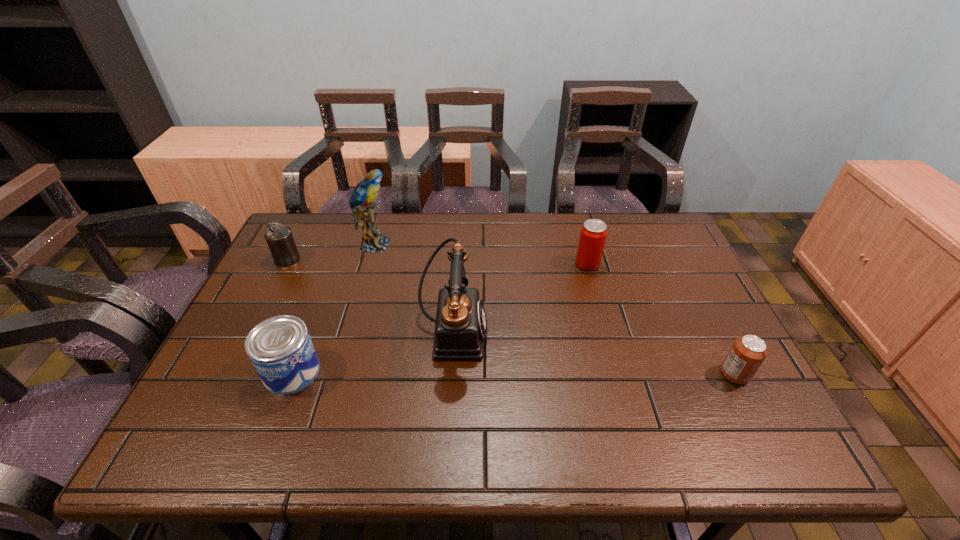
Image resolution: width=960 pixels, height=540 pixels. I want to click on parrot, so click(x=366, y=190).

Find the location of a particular element. the second tallest object is located at coordinates pos(460,325).

At what (x,y) coordinates should I click in order to perform the action: click on telephone. Please return your answer as a coordinate pair (x, y). Looking at the image, I should click on (460, 325).

I want to click on the second can from right to left, so click(593, 234).

Locate an element on the screen. The image size is (960, 540). the leftmost object is located at coordinates coord(279,238).

Identify the location of the second can from left to right. (280, 348).

Locate an element on the screen. the rightmost object is located at coordinates (748, 352).

Where is `vacant space situated 0.400m on the face of the tallest object`? vacant space situated 0.400m on the face of the tallest object is located at coordinates (521, 245).

At what (x,y) coordinates should I click in order to perform the action: click on vacant space situated 0.260m on the front of the third object from right to left at the rotary dial. Please return your answer as a coordinate pair (x, y). Looking at the image, I should click on (589, 331).

Image resolution: width=960 pixels, height=540 pixels. I want to click on vacant space located 0.250m on the left of the third can from left to right, so click(492, 264).